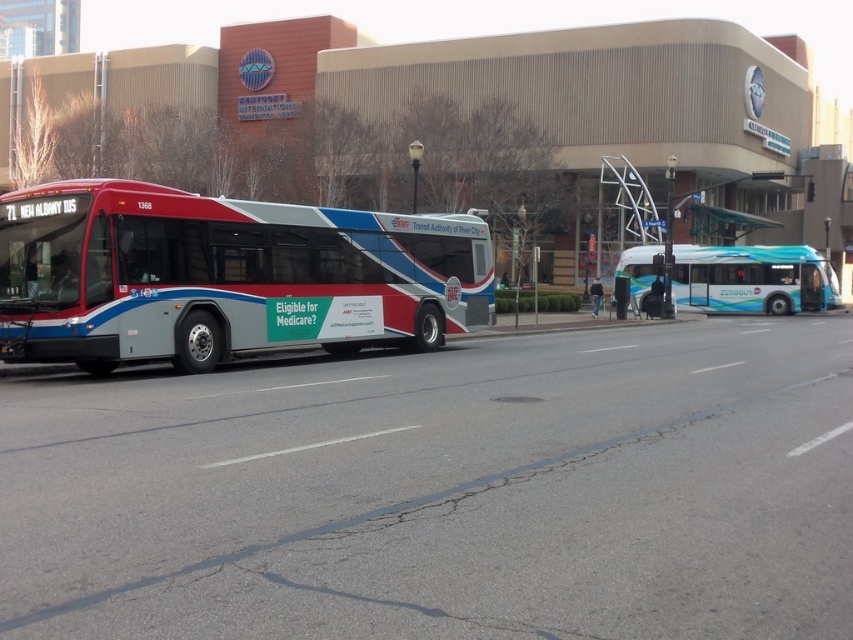
Can you confirm if matte metallic bus at center is positioned to the right of teal glossy bus at center?

No, matte metallic bus at center is not to the right of teal glossy bus at center.

Is point (357, 333) positioned in front of point (787, 248)?

Yes.

You are a GUI agent. You are given a task and a screenshot of the screen. Output one action in this format:
    pyautogui.click(x=<x>, y=<y>)
    Task: Click on the matte metallic bus at center
    Image resolution: width=853 pixels, height=640 pixels.
    Given the screenshot: What is the action you would take?
    pyautogui.click(x=225, y=275)